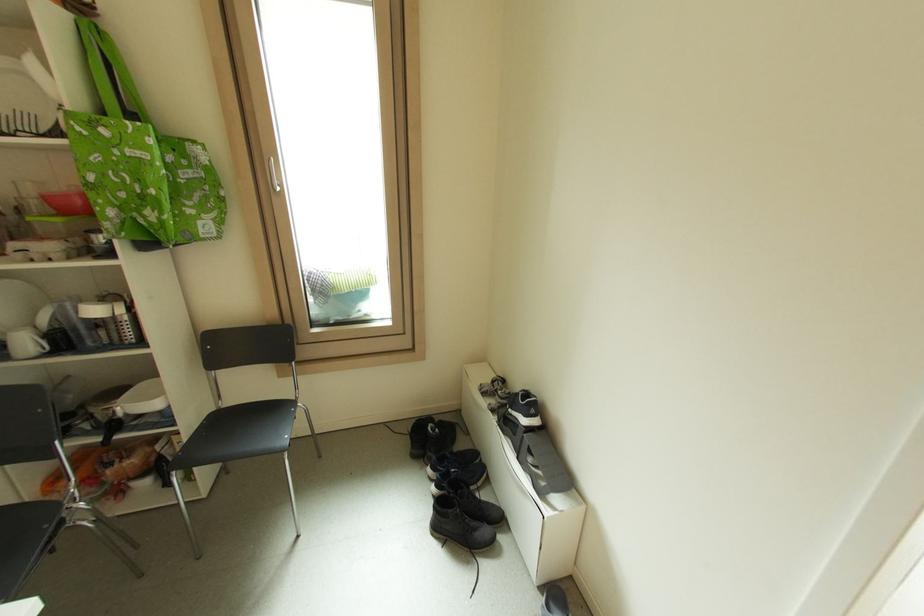
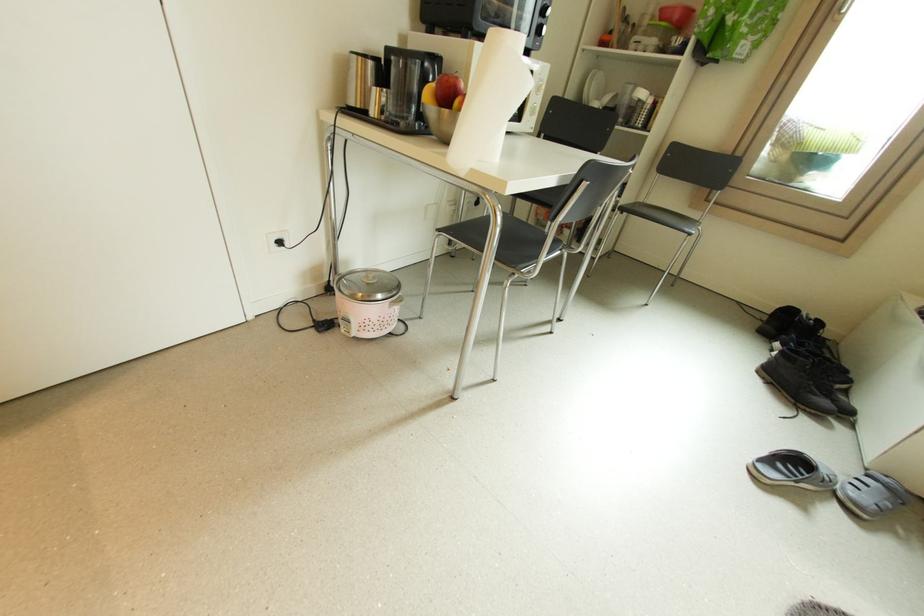
Locate, in the second image, the point that corresponds to (490,532) in the first image.

(830, 403)